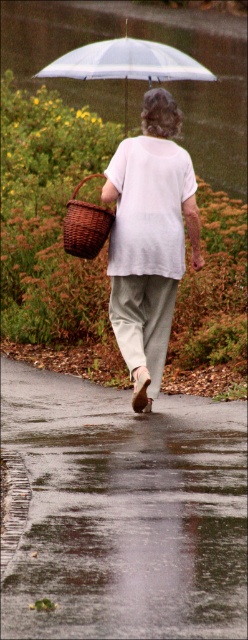
You are standing at the start of the pathway and want to place a small potted plant exactly where the glossy asphalt pavement at lower center and transparent plastic umbrella at upper center are aligned. Which object should you use as your reference point to ensure proper alignment?

The glossy asphalt pavement at lower center is to the right of the transparent plastic umbrella at upper center, so you should use the transparent plastic umbrella at upper center as your reference point to ensure the potted plant is placed correctly.

You are a photographer trying to capture the reflection of the glossy asphalt pavement at lower center and the transparent plastic umbrella at upper center in the wet pathway. Which object will have a narrower reflection in the water?

The glossy asphalt pavement at lower center has a narrower reflection than the transparent plastic umbrella at upper center because it is thinner.